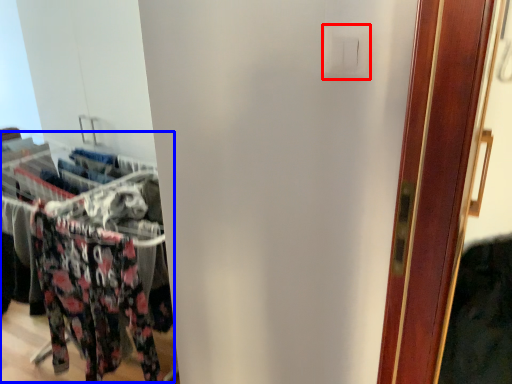
Question: Which point is further to the camera, light switch (highlighted by a red box) or closet (highlighted by a blue box)?

Choices:
 (A) light switch
 (B) closet

Answer: (B)